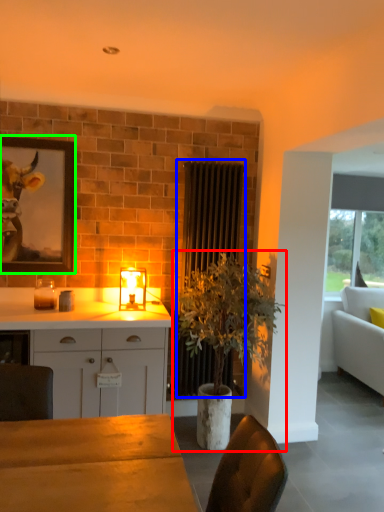
Question: Which object is the closest to the houseplant (highlighted by a red box)? Choose among these: radiator (highlighted by a blue box) or picture frame (highlighted by a green box).

Choices:
 (A) radiator
 (B) picture frame

Answer: (A)